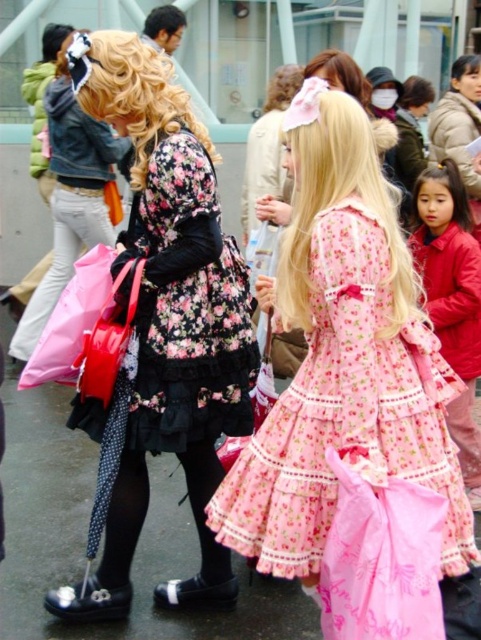
Between floral fabric dress at center and pink floral fabric dress at center, which one has less height?

pink floral fabric dress at center is shorter.

Does floral fabric dress at center have a lesser width compared to pink floral fabric dress at center?

Indeed, floral fabric dress at center has a lesser width compared to pink floral fabric dress at center.

Find the location of `floral fabric dress at center`. floral fabric dress at center is located at coordinates (163, 324).

Which is behind, point (156, 330) or point (435, 269)?

Point (435, 269)

Between floral-patterned fabric dress at center and pink satin dress at center, which one has more height?

With more height is pink satin dress at center.

Locate an element on the screen. This screenshot has height=640, width=481. floral-patterned fabric dress at center is located at coordinates (187, 307).

Does floral fabric dress at center come in front of pink satin dress at center?

Yes, floral fabric dress at center is closer to the viewer.

Which is in front, point (203, 353) or point (457, 180)?

Point (203, 353) is more forward.

At what (x,y) coordinates should I click in order to perform the action: click on floral fabric dress at center. Please return your answer as a coordinate pair (x, y). This screenshot has height=640, width=481. Looking at the image, I should click on (163, 324).